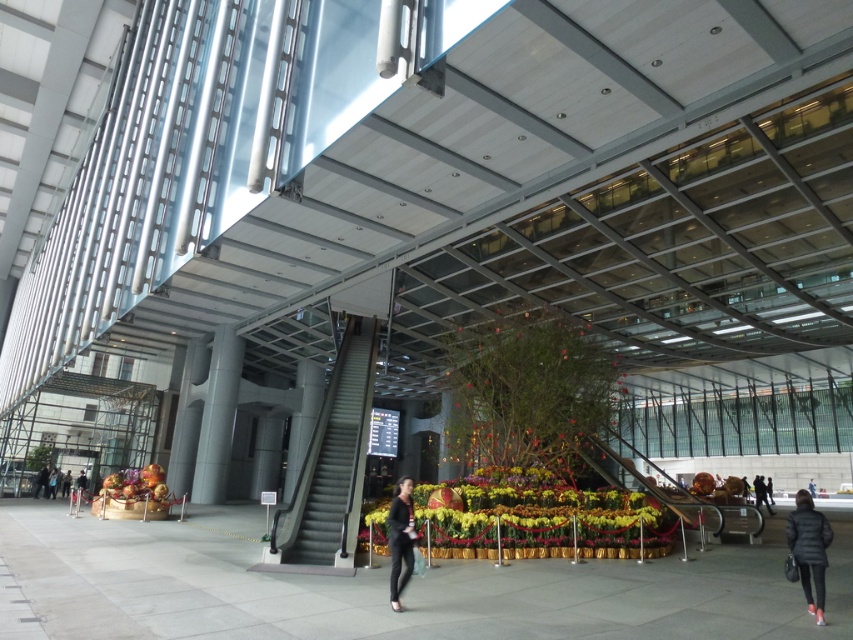
This screenshot has width=853, height=640. What do you see at coordinates (540, 516) in the screenshot? I see `yellow floral arrangement at center` at bounding box center [540, 516].

Who is taller, yellow floral arrangement at center or black matte pants at center?

Standing taller between the two is yellow floral arrangement at center.

Who is more distant from viewer, (532, 520) or (409, 538)?

Point (532, 520)

Image resolution: width=853 pixels, height=640 pixels. Find the location of `yellow floral arrangement at center`. yellow floral arrangement at center is located at coordinates (540, 516).

Which is in front, point (548, 496) or point (757, 486)?

Point (548, 496) is more forward.

Does point (631, 515) come farther from viewer compared to point (759, 500)?

No, it is in front of (759, 500).

What do you see at coordinates (540, 516) in the screenshot? I see `yellow floral arrangement at center` at bounding box center [540, 516].

At what (x,y) coordinates should I click in order to perform the action: click on yellow floral arrangement at center. Please return your answer as a coordinate pair (x, y). Looking at the image, I should click on (540, 516).

This screenshot has width=853, height=640. Identify the location of matte black jacket at lower right. (809, 548).

Image resolution: width=853 pixels, height=640 pixels. Describe the element at coordinates (809, 548) in the screenshot. I see `matte black jacket at lower right` at that location.

Where is `matte black jacket at lower right`? The height and width of the screenshot is (640, 853). matte black jacket at lower right is located at coordinates (809, 548).